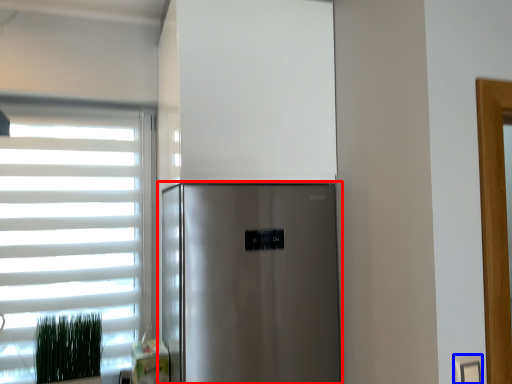
Question: Which object is further to the camera taking this photo, refrigerator (highlighted by a red box) or electric outlet (highlighted by a blue box)?

Choices:
 (A) refrigerator
 (B) electric outlet

Answer: (A)